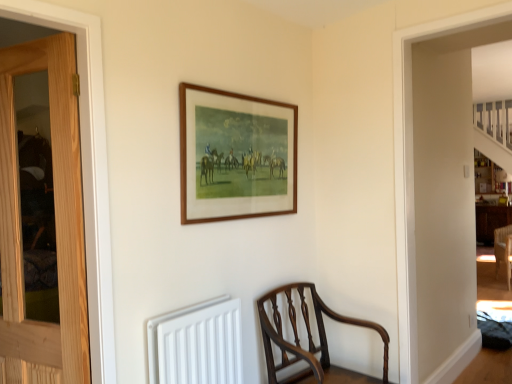
Question: Relative to light brown wood door at left, is wooden picture frame at upper center in front or behind?

Choices:
 (A) front
 (B) behind

Answer: (B)

Question: Considering the positions of point (294, 147) and point (18, 74), is point (294, 147) closer or farther from the camera than point (18, 74)?

Choices:
 (A) farther
 (B) closer

Answer: (A)

Question: Based on their relative distances, which object is farther from the wooden picture frame at upper center?

Choices:
 (A) light brown wood door at left
 (B) white matte radiator at lower center
 (C) mahogany wood chair at lower center

Answer: (C)

Question: Considering the real-world distances, which object is farthest from the light brown wood door at left?

Choices:
 (A) mahogany wood chair at lower center
 (B) wooden picture frame at upper center
 (C) white matte radiator at lower center

Answer: (A)